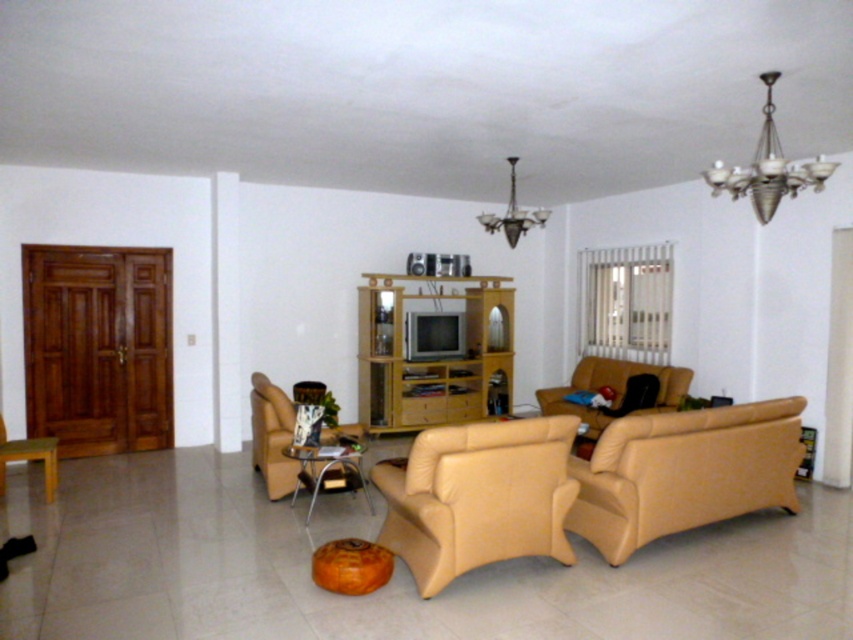
Can you confirm if wooden chair at lower left is taller than metallic chandelier at upper center?

Indeed, wooden chair at lower left has a greater height compared to metallic chandelier at upper center.

I want to click on wooden chair at lower left, so click(x=28, y=458).

Does leather couch at center appear under beige leather couch at center?

Answer: Yes, leather couch at center is below beige leather couch at center.

Who is positioned more to the right, leather couch at center or beige leather couch at center?

leather couch at center

Does point (598, 518) come in front of point (618, 385)?

Yes.

You are a GUI agent. You are given a task and a screenshot of the screen. Output one action in this format:
    pyautogui.click(x=<x>, y=<y>)
    Task: Click on the leather couch at center
    
    Given the screenshot: What is the action you would take?
    pyautogui.click(x=683, y=472)

Is beige leather armchair at center thinner than beige leather chair at lower left?

No.

Between beige leather armchair at center and beige leather chair at lower left, which one is positioned lower?

Positioned lower is beige leather chair at lower left.

Where is `beige leather armchair at center`? This screenshot has width=853, height=640. beige leather armchair at center is located at coordinates (479, 497).